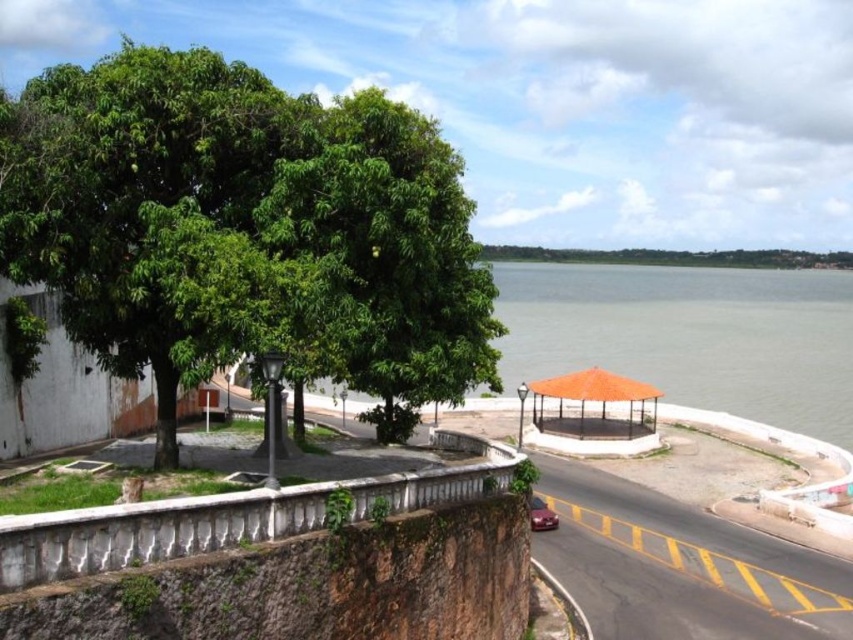
From the picture: You are standing at the center of the image and want to walk towards the green leafy tree at upper left. Which direction should you face to head directly towards it?

You should face the upper left direction to head directly towards the green leafy tree at upper left since it is located at point (248,230), which is in the upper left quadrant of the image.

You are standing at the riverside and want to take a photo of both the green leafy tree at upper left and the shiny red car at lower center. Which object should you frame first in your camera viewfinder to ensure both are in the shot?

You should frame the green leafy tree at upper left first since it is closer to the viewer than the shiny red car at lower center, ensuring both are in focus and within the frame.